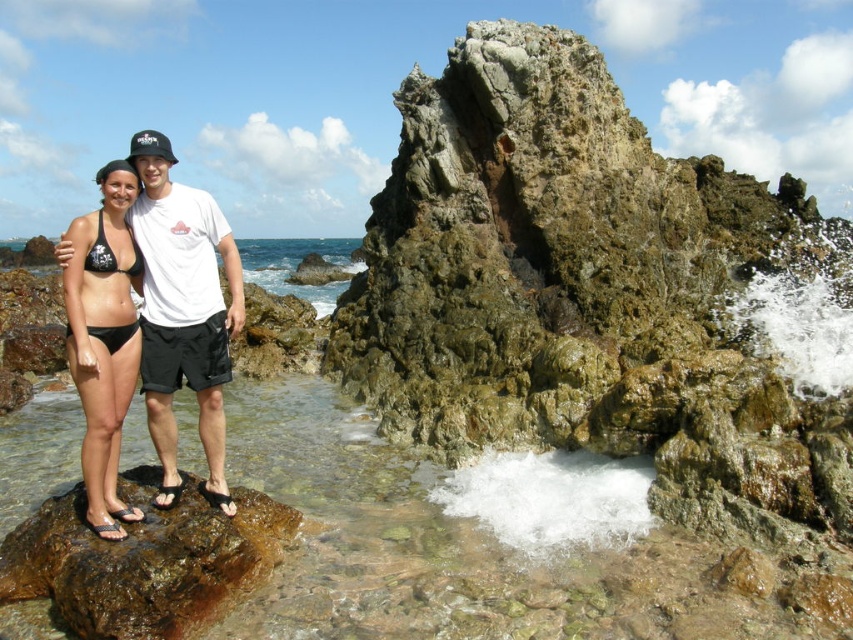
Is point (469, 115) positioned before point (219, 234)?

No.

Does green mossy rock at center appear on the right side of matte black bikini at left?

Yes, green mossy rock at center is to the right of matte black bikini at left.

The width and height of the screenshot is (853, 640). I want to click on green mossy rock at center, so click(585, 292).

Is point (47, 595) positioned after point (86, 518)?

That is False.

Is point (219, 572) positioned behind point (131, 353)?

No, it is not.

This screenshot has width=853, height=640. In order to click on brown rough rock at lower left in this screenshot , I will do `click(144, 560)`.

Between matte black bikini at left and black matte bikini at center, which one is positioned lower?

Positioned lower is black matte bikini at center.

Is matte black bikini at left positioned in front of black matte bikini at center?

That is False.

Measure the distance between point (165, 397) and camera.

Point (165, 397) and camera are 82.51 feet apart.

At what (x,y) coordinates should I click in order to perform the action: click on matte black bikini at left. Please return your answer as a coordinate pair (x, y). Image resolution: width=853 pixels, height=640 pixels. Looking at the image, I should click on (183, 310).